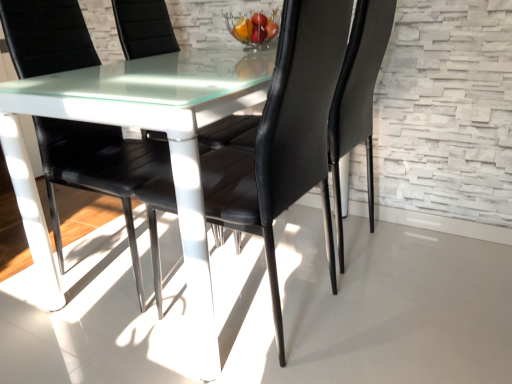
Question: Can you confirm if black leather chair at center, the first chair viewed from the right, is bigger than black leather chair at center, which is the 4th chair from right to left?

Choices:
 (A) no
 (B) yes

Answer: (A)

Question: From a real-world perspective, is black leather chair at center, the fourth chair in the left-to-right sequence, located beneath black leather chair at center, which is the 4th chair from right to left?

Choices:
 (A) no
 (B) yes

Answer: (B)

Question: Is the position of black leather chair at center, the fourth chair in the left-to-right sequence, less distant than that of black leather chair at center, the first chair positioned from the left?

Choices:
 (A) no
 (B) yes

Answer: (A)

Question: Can you confirm if black leather chair at center, the first chair viewed from the right, is wider than black leather chair at center, which is the 4th chair from right to left?

Choices:
 (A) yes
 (B) no

Answer: (B)

Question: Can you confirm if black leather chair at center, the fourth chair in the left-to-right sequence, is positioned to the right of black leather chair at center, the first chair positioned from the left?

Choices:
 (A) no
 (B) yes

Answer: (B)

Question: Can you confirm if black leather chair at center, the fourth chair in the left-to-right sequence, is shorter than black leather chair at center, which is the 4th chair from right to left?

Choices:
 (A) no
 (B) yes

Answer: (B)

Question: Is black leather chair at center, which is the 4th chair from right to left, beside black leather chair at center, marked as the 2th chair in a left-to-right arrangement?

Choices:
 (A) yes
 (B) no

Answer: (B)

Question: Is black leather chair at center, the first chair positioned from the left, facing towards black leather chair at center, marked as the 2th chair in a left-to-right arrangement?

Choices:
 (A) yes
 (B) no

Answer: (B)

Question: Does black leather chair at center, which is the 4th chair from right to left, have a larger size compared to black leather chair at center, which appears as the 3th chair when viewed from the right?

Choices:
 (A) yes
 (B) no

Answer: (A)

Question: From the image's perspective, is black leather chair at center, which is the 4th chair from right to left, above black leather chair at center, marked as the 2th chair in a left-to-right arrangement?

Choices:
 (A) no
 (B) yes

Answer: (A)

Question: Would you consider black leather chair at center, which is the 4th chair from right to left, to be distant from black leather chair at center, which appears as the 3th chair when viewed from the right?

Choices:
 (A) yes
 (B) no

Answer: (B)

Question: Is the position of black leather chair at center, the first chair positioned from the left, more distant than that of black leather chair at center, which appears as the 3th chair when viewed from the right?

Choices:
 (A) no
 (B) yes

Answer: (A)

Question: Considering the relative sizes of black leather chair at center, which ranks as the third chair in left-to-right order, and black leather chair at center, the fourth chair in the left-to-right sequence, in the image provided, is black leather chair at center, which ranks as the third chair in left-to-right order, smaller than black leather chair at center, the fourth chair in the left-to-right sequence,?

Choices:
 (A) yes
 (B) no

Answer: (B)